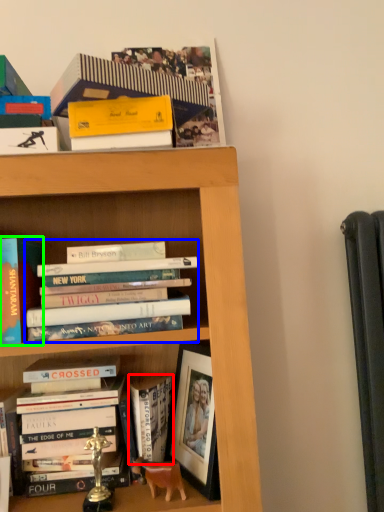
Question: Which object is positioned farthest from book (highlighted by a red box)? Select from book (highlighted by a blue box) and book (highlighted by a green box).

Choices:
 (A) book
 (B) book

Answer: (B)